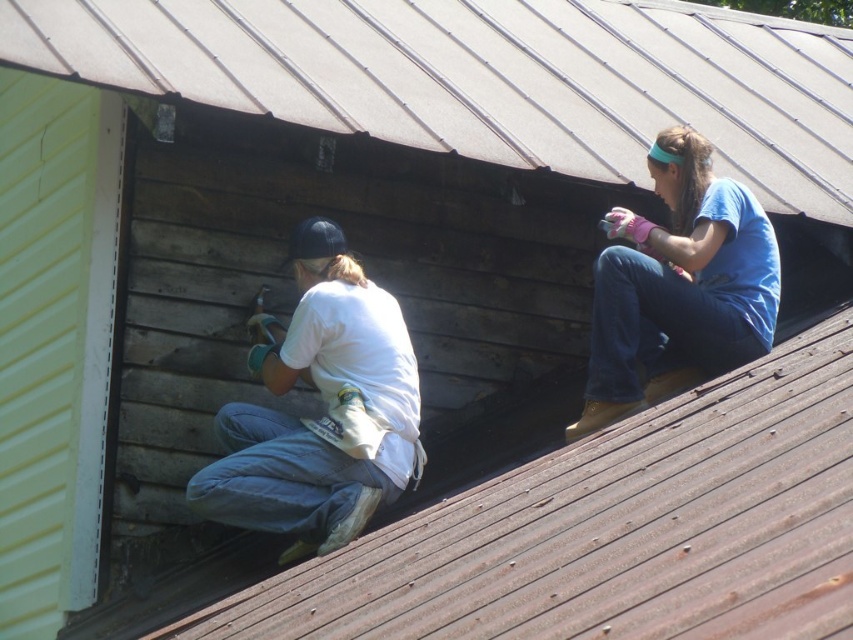
Can you confirm if white matte shirt at lower left is positioned above blue cotton shirt at upper right?

Incorrect, white matte shirt at lower left is not positioned above blue cotton shirt at upper right.

Who is more forward, (329, 435) or (730, 220)?

Positioned in front is point (329, 435).

Is point (364, 285) more distant than point (662, 385)?

Yes.

Where is `white matte shirt at lower left`? The height and width of the screenshot is (640, 853). white matte shirt at lower left is located at coordinates click(x=326, y=412).

Does metallic gray roof at upper center have a smaller size compared to white matte shirt at lower left?

Actually, metallic gray roof at upper center might be larger than white matte shirt at lower left.

What do you see at coordinates (488, 77) in the screenshot? The image size is (853, 640). I see `metallic gray roof at upper center` at bounding box center [488, 77].

Is point (399, 108) less distant than point (335, 493)?

No, (399, 108) is further to viewer.

This screenshot has height=640, width=853. What are the coordinates of `metallic gray roof at upper center` in the screenshot? It's located at (488, 77).

Can you confirm if metallic gray roof at upper center is positioned to the left of blue cotton shirt at upper right?

Incorrect, metallic gray roof at upper center is not on the left side of blue cotton shirt at upper right.

Is metallic gray roof at upper center shorter than blue cotton shirt at upper right?

No.

Is point (329, 81) closer to camera compared to point (608, 314)?

That is False.

Where is `metallic gray roof at upper center`? This screenshot has width=853, height=640. metallic gray roof at upper center is located at coordinates tap(488, 77).